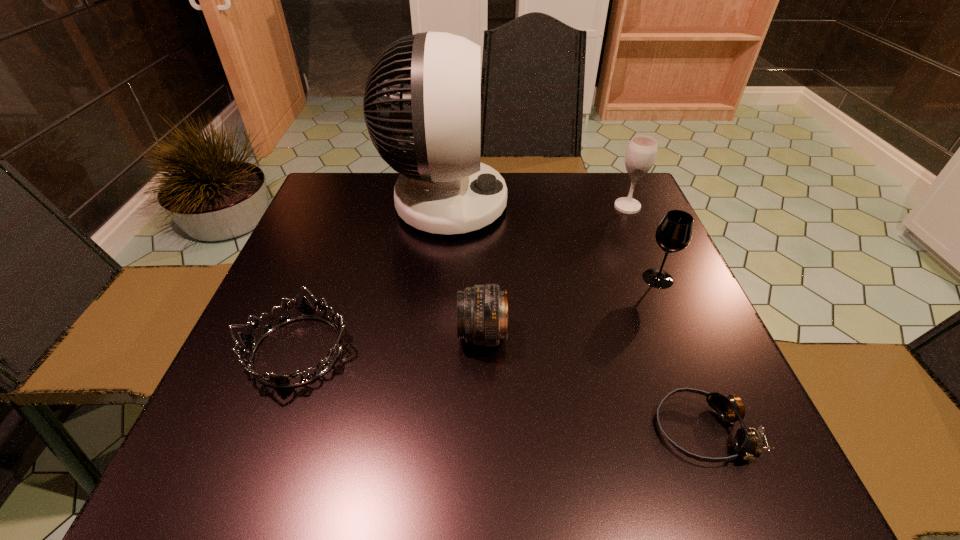
Identify which object is located as the fifth nearest to the telephoto lens. Please provide its 2D coordinates. Your answer should be formatted as a tuple, i.e. [(x, y)], where the tuple contains the x and y coordinates of a point satisfying the conditions above.

[(641, 152)]

This screenshot has height=540, width=960. Find the location of `vacant space that satisfies the following two spatial constraints: 1. on the grille of the farther wineglass; 2. on the left side of the tallest object`. vacant space that satisfies the following two spatial constraints: 1. on the grille of the farther wineglass; 2. on the left side of the tallest object is located at coordinates (444, 207).

Locate an element on the screen. This screenshot has width=960, height=540. vacant point that satisfies the following two spatial constraints: 1. on the back side of the third farthest object; 2. on the left side of the farther wineglass is located at coordinates (627, 207).

Identify the location of free region that satisfies the following two spatial constraints: 1. on the back side of the farther wineglass; 2. on the right side of the third farthest object. (627, 207).

What are the coordinates of `vacant space that satisfies the following two spatial constraints: 1. on the grille of the fan; 2. on the right side of the farther wineglass` in the screenshot? It's located at (444, 207).

Find the location of a particular element. The width and height of the screenshot is (960, 540). vacant space that satisfies the following two spatial constraints: 1. on the front side of the nearer wineglass; 2. through the lenses of the goggles is located at coordinates (723, 430).

Image resolution: width=960 pixels, height=540 pixels. What are the coordinates of `vacant space that satisfies the following two spatial constraints: 1. on the front side of the third farthest object; 2. at the front element of the third shortest object` in the screenshot? It's located at (682, 335).